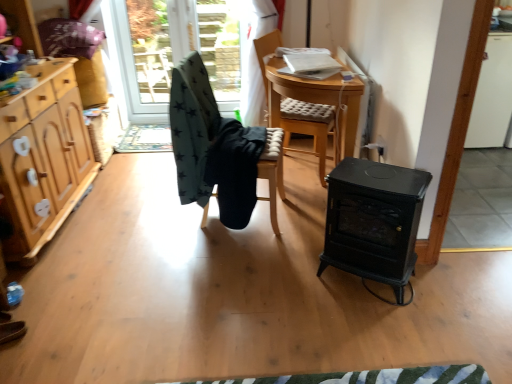
The width and height of the screenshot is (512, 384). I want to click on free spot to the left of black cast iron stove at center, so (301, 280).